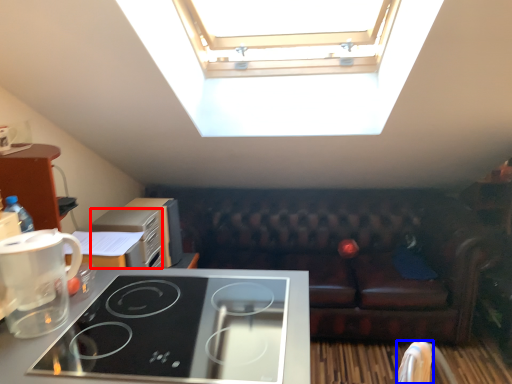
Question: Which point is further to the camera, appliance (highlighted by a red box) or armchair (highlighted by a blue box)?

Choices:
 (A) appliance
 (B) armchair

Answer: (A)